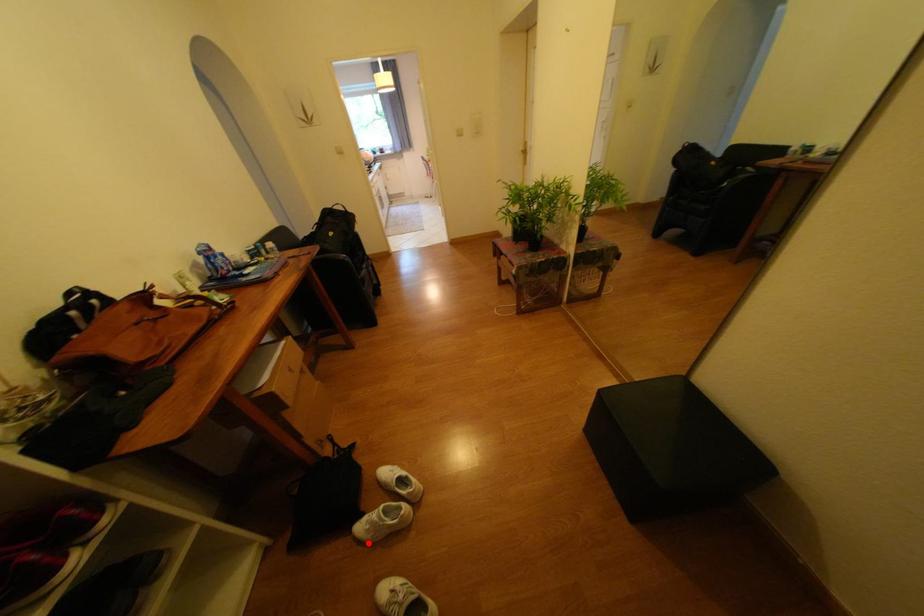
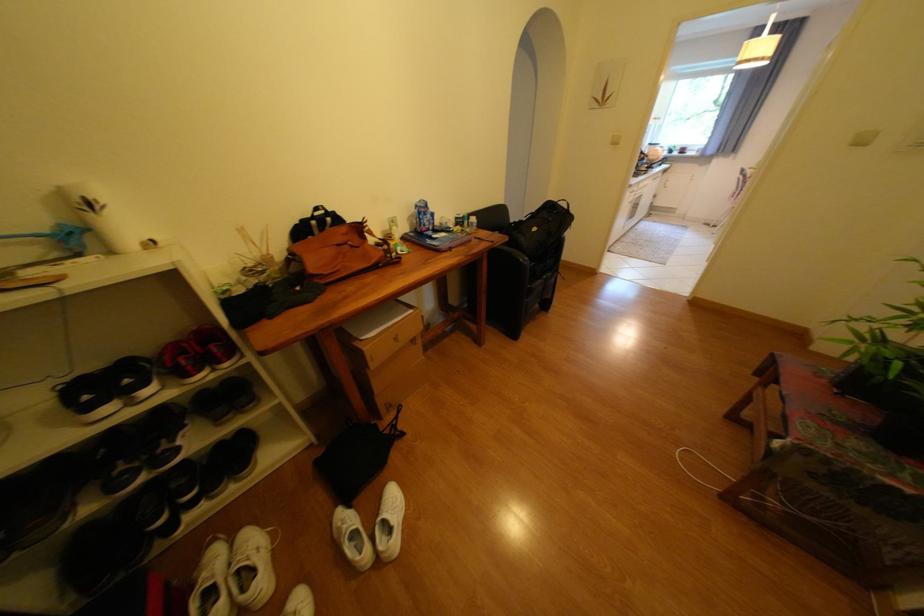
Question: A red point is marked in image1. In image2, is the corresponding 3D point closer to the camera or farther? Reply with the corresponding letter.

Choices:
 (A) The corresponding 3D point is closer.
 (B) The corresponding 3D point is farther.

Answer: (A)